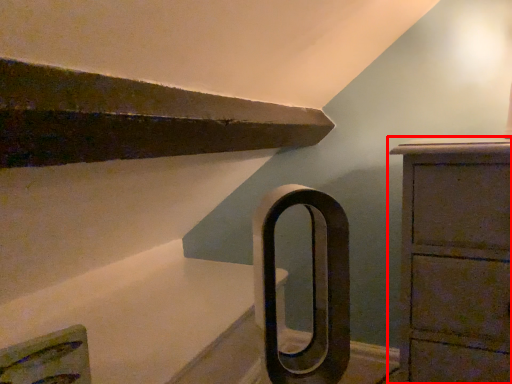
Question: From the image's perspective, where is chest of drawers (annotated by the red box) located in relation to door handle in the image?

Choices:
 (A) above
 (B) below

Answer: (B)